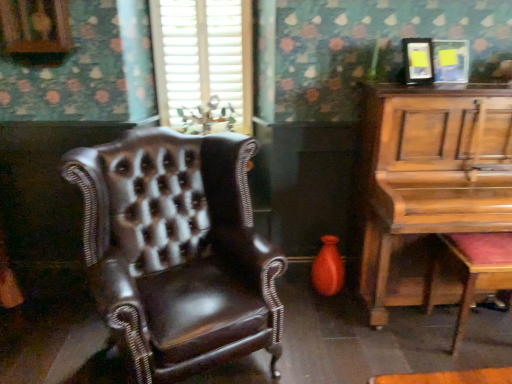
Locate an element on the screen. This screenshot has height=384, width=512. blank space to the left of wooden polished music stool at lower right is located at coordinates (408, 339).